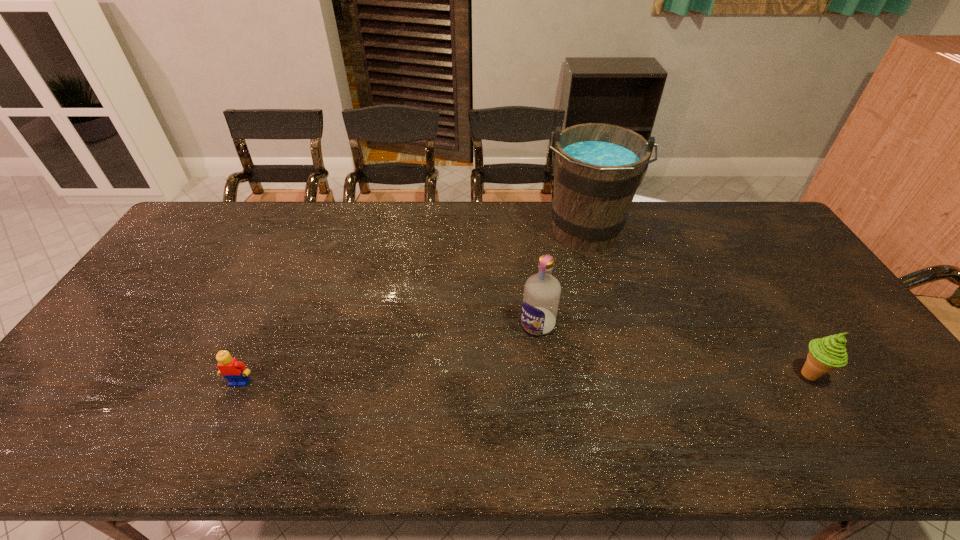
Identify the location of free space on the desktop that is between the Lego and the rightmost object and is positioned with a handle on the side of the wine bucket. Image resolution: width=960 pixels, height=540 pixels. (565, 378).

This screenshot has height=540, width=960. I want to click on free space on the desktop that is between the Lego and the third tallest object and is positioned on the label of the second tallest object, so click(492, 379).